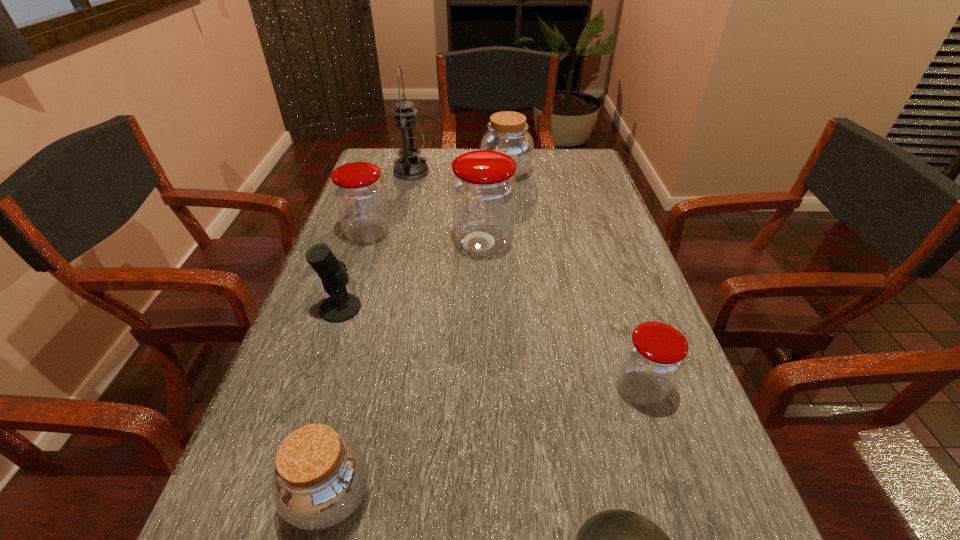
In order to click on vacant space located 0.330m on the front of the oil lamp in this screenshot , I will do `click(393, 247)`.

Image resolution: width=960 pixels, height=540 pixels. In order to click on free location located 0.180m on the left of the seventh shortest object in this screenshot , I will do `click(382, 244)`.

Identify the location of free space located 0.220m on the front of the farther brown jar. (511, 228).

Locate an element on the screen. free region located on the front of the leftmost red jar is located at coordinates (356, 268).

Identify the location of vacant region located on the back of the fourth nearest object. This screenshot has height=540, width=960. (x=364, y=239).

Find the location of a particular element. The height and width of the screenshot is (540, 960). vacant region located 0.220m on the back of the rightmost red jar is located at coordinates (609, 289).

This screenshot has height=540, width=960. I want to click on oil lamp that is at the far edge, so click(x=407, y=138).

Find the location of `jar that is at the far edge`. jar that is at the far edge is located at coordinates (507, 133).

Where is `oil lamp that is at the left edge`? The image size is (960, 540). oil lamp that is at the left edge is located at coordinates (407, 138).

Locate an element on the screen. The width and height of the screenshot is (960, 540). jar at the left edge is located at coordinates (359, 193).